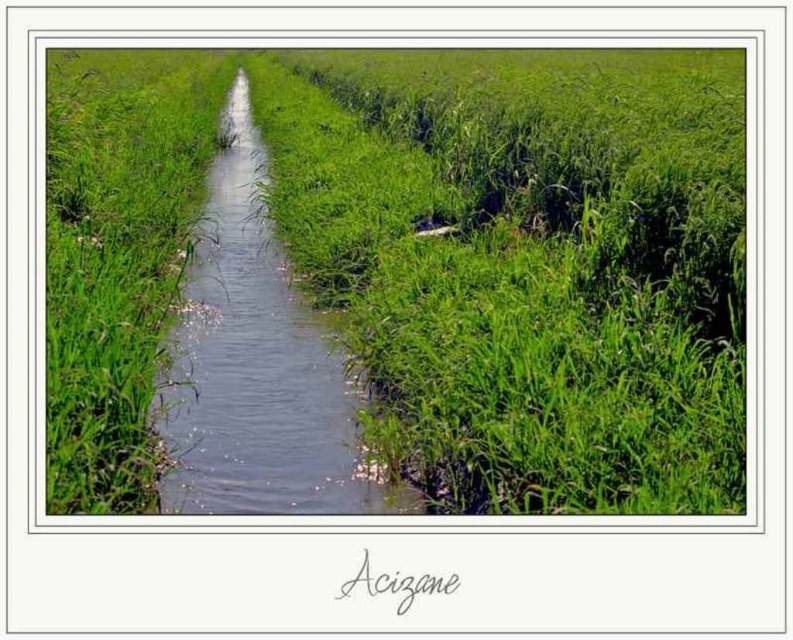
Question: Which of the following is the farthest from the observer?

Choices:
 (A) green grass at center
 (B) clear water stream at center

Answer: (B)

Question: Does green grass at center lie in front of clear water stream at center?

Choices:
 (A) no
 (B) yes

Answer: (B)

Question: Which of the following is the farthest from the observer?

Choices:
 (A) clear water stream at center
 (B) green grass at center

Answer: (A)

Question: From the image, what is the correct spatial relationship of green grass at center in relation to clear water stream at center?

Choices:
 (A) above
 (B) below

Answer: (A)

Question: Can you confirm if green grass at center is positioned below clear water stream at center?

Choices:
 (A) no
 (B) yes

Answer: (A)